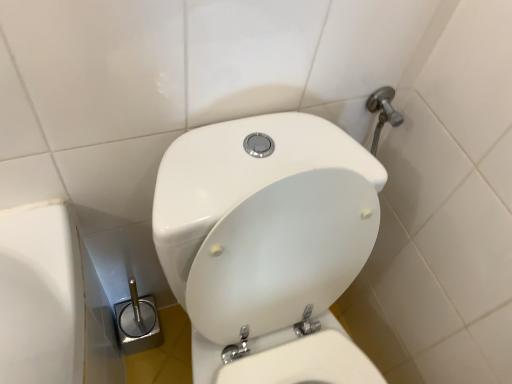
Measure the distance between white glossy toilet at center and camera.

white glossy toilet at center and camera are 54.86 centimeters apart from each other.

Find the location of a particular element. Image resolution: width=512 pixels, height=384 pixels. white glossy toilet at center is located at coordinates (268, 245).

Image resolution: width=512 pixels, height=384 pixels. Describe the element at coordinates (268, 245) in the screenshot. I see `white glossy toilet at center` at that location.

Identify the location of white glossy toilet at center. The height and width of the screenshot is (384, 512). point(268,245).